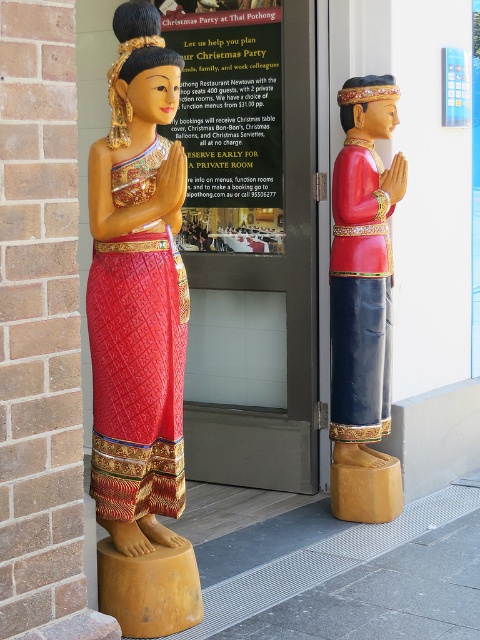
Question: Does wooden statue at left have a smaller size compared to wooden statue at right?

Choices:
 (A) yes
 (B) no

Answer: (B)

Question: Does wooden statue at left appear on the right side of wooden statue at right?

Choices:
 (A) no
 (B) yes

Answer: (A)

Question: Is wooden statue at left behind wooden statue at right?

Choices:
 (A) no
 (B) yes

Answer: (A)

Question: Which of the following is the farthest from the observer?

Choices:
 (A) wooden statue at left
 (B) wooden statue at right

Answer: (B)